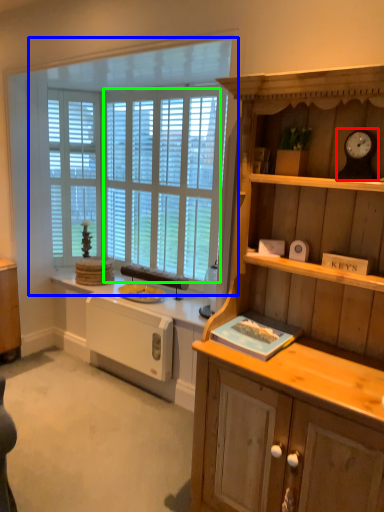
Question: Considering the real-world distances, which object is closest to clock (highlighted by a red box)? window (highlighted by a blue box) or window screen (highlighted by a green box).

Choices:
 (A) window
 (B) window screen

Answer: (A)